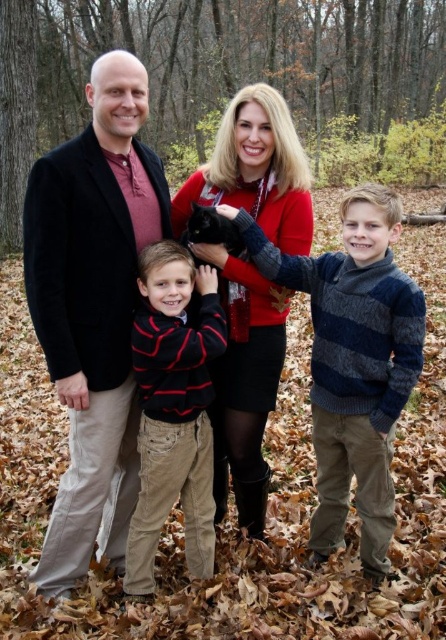
Question: From the image, what is the correct spatial relationship of striped wool sweater at center in relation to velvet red sweater at center?

Choices:
 (A) right
 (B) left

Answer: (A)

Question: Is striped wool sweater at center bigger than striped cotton shirt at center?

Choices:
 (A) yes
 (B) no

Answer: (A)

Question: Estimate the real-world distances between objects in this image. Which object is closer to the striped wool sweater at center?

Choices:
 (A) striped cotton shirt at center
 (B) velvet red sweater at center

Answer: (A)

Question: Does black cotton jacket at left appear under striped cotton shirt at center?

Choices:
 (A) no
 (B) yes

Answer: (A)

Question: Which object is farther from the camera taking this photo?

Choices:
 (A) striped cotton shirt at center
 (B) black cotton jacket at left

Answer: (A)

Question: Which is nearer to the velvet red sweater at center?

Choices:
 (A) striped wool sweater at center
 (B) striped cotton shirt at center
 (C) black cotton jacket at left

Answer: (B)